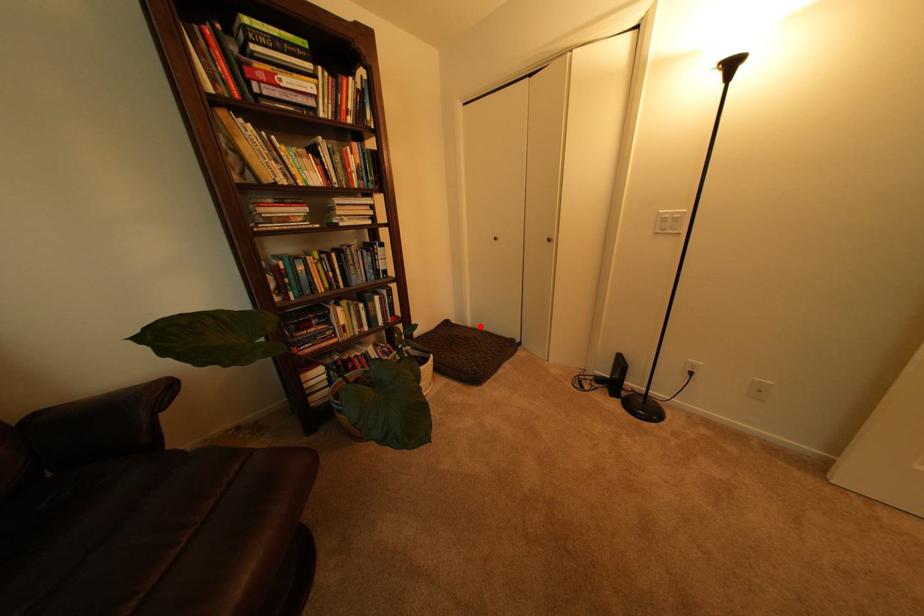
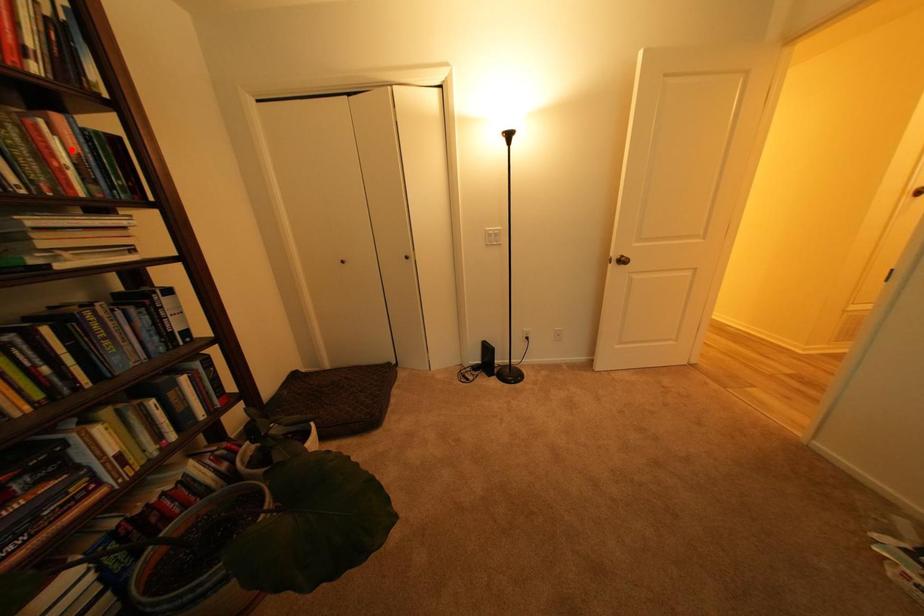
I am providing you with two images of the same scene from different viewpoints. A red point is marked on the first image and another point is marked on the second image. Do the highlighted points in image1 and image2 indicate the same real-world spot?

No